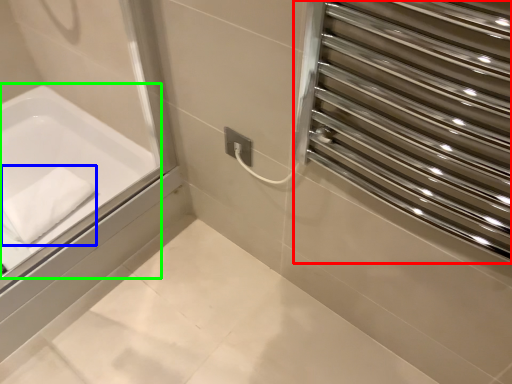
Question: Based on their relative distances, which object is farther from screen door (highlighted by a red box)? Choose from bath towel (highlighted by a blue box) and bathtub (highlighted by a green box).

Choices:
 (A) bath towel
 (B) bathtub

Answer: (A)